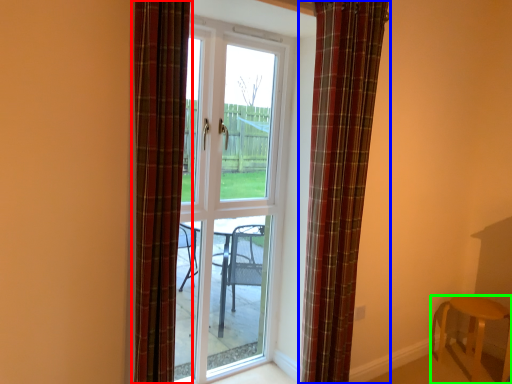
Question: Considering the real-world distances, which object is closest to curtain (highlighted by a red box)? curtain (highlighted by a blue box) or furniture (highlighted by a green box).

Choices:
 (A) curtain
 (B) furniture

Answer: (A)